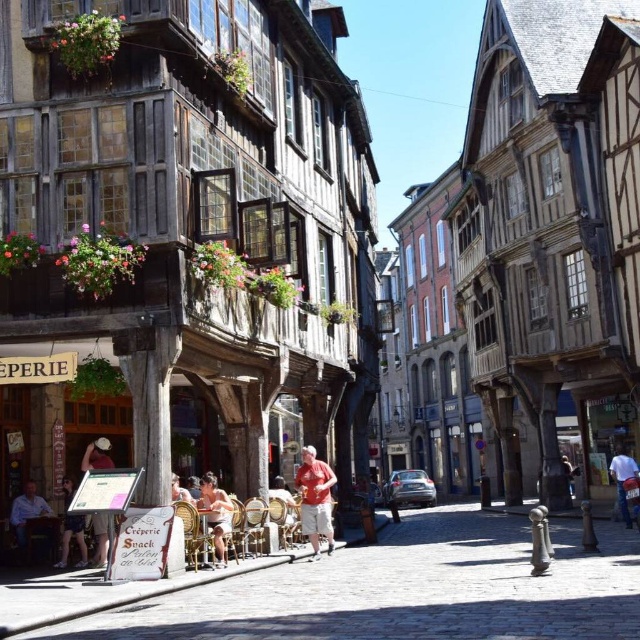
From the picture: You are a tourist standing at the entrance of the cobblestone street. You see a matte red shirt at center and a light brown wooden chair at lower center. Which object is closer to the ground?

The matte red shirt at center is located below the light brown wooden chair at lower center, so the matte red shirt at center is closer to the ground.

You are a tourist walking down the cobblestone street and notice a matte white hat at center and a dark brown leather jacket at center. Which item is positioned more to the left side of the street?

The matte white hat at center is positioned more to the left side of the street compared to the dark brown leather jacket at center.